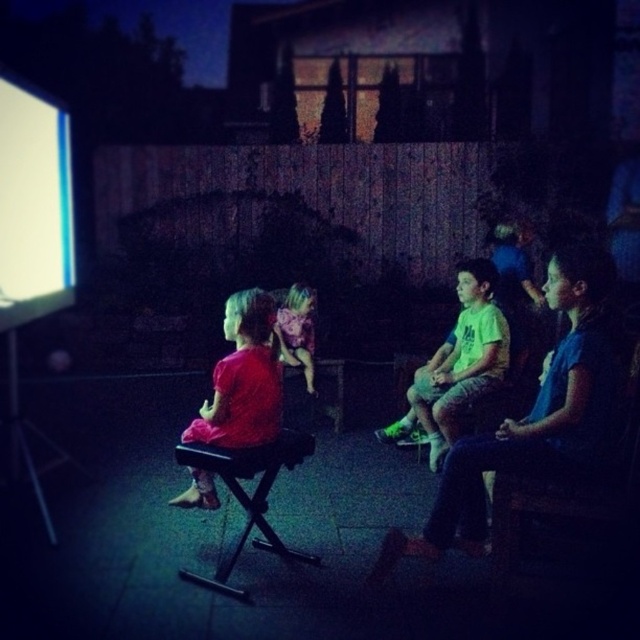
Looking at this image, you are a photographer trying to capture a closeup of the shiny pink wig at center without including the dark blue jeans at right in the frame. Given their sizes, which object should you focus on to ensure the wig is centered and the jeans are out of view?

The dark blue jeans at right is larger in size than shiny pink wig at center. To avoid including the larger dark blue jeans at right in the frame, focus on the smaller shiny pink wig at center and position the camera so the jeans are outside the shot.

You are a parent who wants to place a 3.5 feet wide snack table between the white glossy projection screen at left and the black plastic stool at lower left. Based on the scene description, will the snack table fit without overlapping either object?

The distance between the white glossy projection screen at left and the black plastic stool at lower left is 5.00 feet. Since the snack table is 3.5 feet wide, it will fit as long as it is placed centrally between them, leaving 0.75 feet of space on each side.

You are a parent trying to locate your child who is wearing a shiny pink wig at center. You see the black plastic stool at lower left. Which direction should you look relative to the stool to find the wig?

The shiny pink wig at center is to the right of the black plastic stool at lower left, so you should look to the right of the stool.